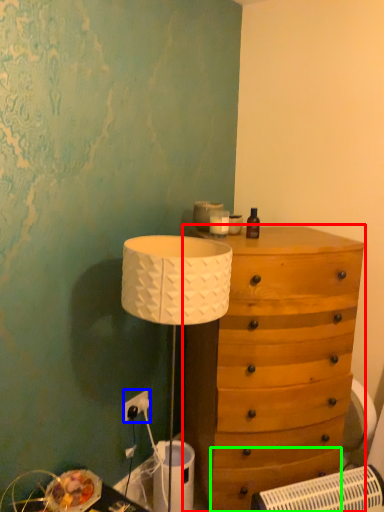
Question: Considering the real-world distances, which object is closest to chest of drawers (highlighted by a red box)? electric outlet (highlighted by a blue box) or drawer (highlighted by a green box).

Choices:
 (A) electric outlet
 (B) drawer

Answer: (B)